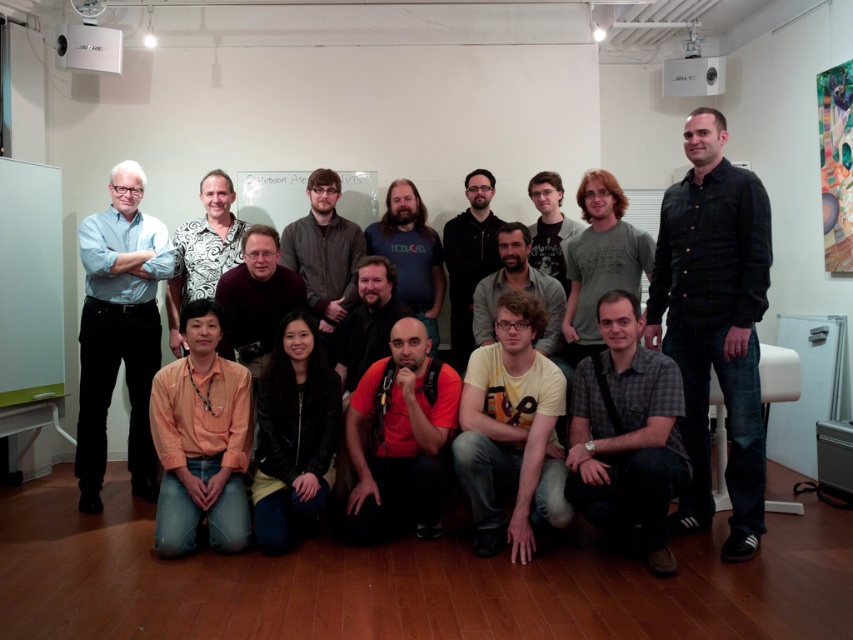
Question: Can you confirm if gray checkered shirt at lower center is positioned to the right of dark gray t-shirt at center?

Choices:
 (A) yes
 (B) no

Answer: (A)

Question: Which of the following is the closest to the observer?

Choices:
 (A) dark gray jacket at center
 (B) dark gray t-shirt at center
 (C) bearded man at center
 (D) matte black shirt at center

Answer: (D)

Question: Can you confirm if black denim shirt at right is thinner than black matte shirt at center?

Choices:
 (A) yes
 (B) no

Answer: (B)

Question: Does orange shirt at lower left have a lesser width compared to dark gray t-shirt at center?

Choices:
 (A) no
 (B) yes

Answer: (A)

Question: Which of the following is the farthest from the observer?

Choices:
 (A) black matte shirt at center
 (B) dark gray jacket at center
 (C) bearded man at center

Answer: (A)

Question: Which point appears farthest from the camera in this image?

Choices:
 (A) click(x=552, y=296)
 (B) click(x=287, y=300)

Answer: (A)